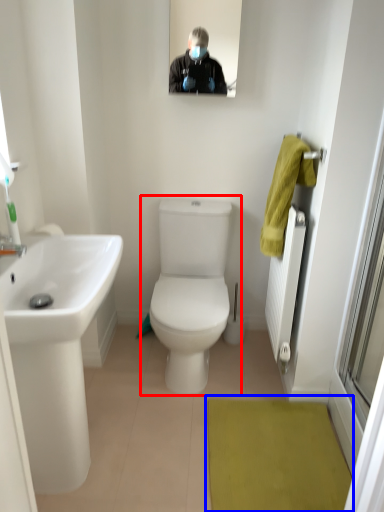
Question: Which object appears closest to the camera in this image, toilet (highlighted by a red box) or bath mat (highlighted by a blue box)?

Choices:
 (A) toilet
 (B) bath mat

Answer: (B)